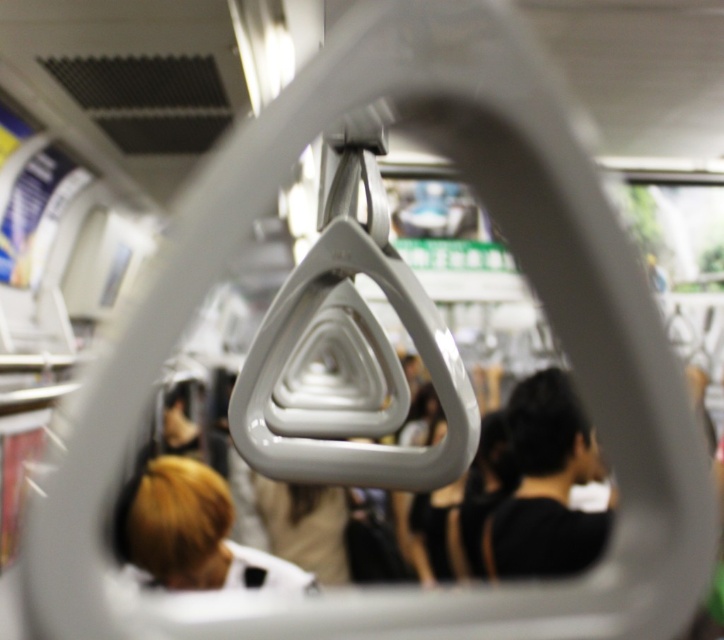
Between black matte hair at center and blonde hair at lower left, which one is positioned lower?

blonde hair at lower left is below.

Between point (581, 426) and point (140, 540), which one is positioned behind?

The point (581, 426) is more distant.

Locate an element on the screen. Image resolution: width=724 pixels, height=640 pixels. black matte hair at center is located at coordinates (547, 484).